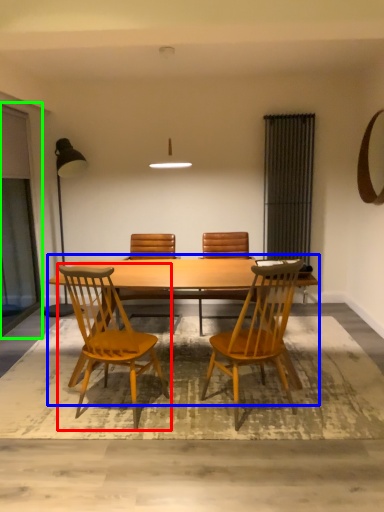
Question: Which is farther away from chair (highlighted by a red box)? kitchen & dining room table (highlighted by a blue box) or screen door (highlighted by a green box)?

Choices:
 (A) kitchen & dining room table
 (B) screen door

Answer: (B)